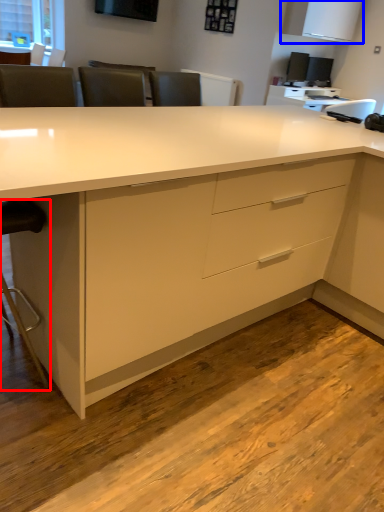
Question: Which object appears farthest to the camera in this image, swivel chair (highlighted by a red box) or cabinetry (highlighted by a blue box)?

Choices:
 (A) swivel chair
 (B) cabinetry

Answer: (B)